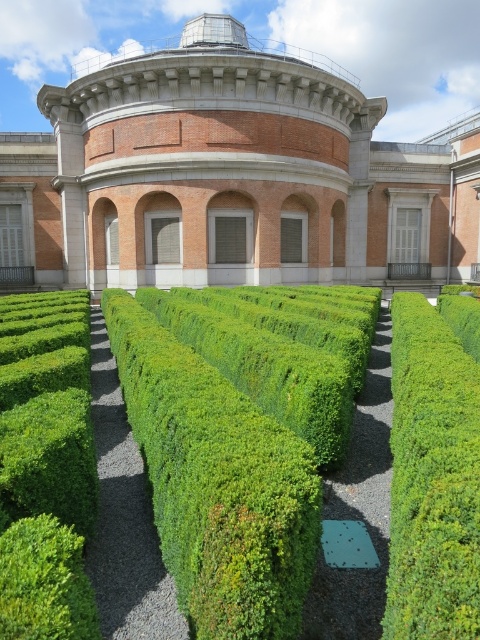
Question: Which point is closer to the camera?

Choices:
 (A) (374, 150)
 (B) (410, 308)
 (C) (33, 586)
 (D) (410, 536)

Answer: (C)

Question: Among these objects, which one is nearest to the camera?

Choices:
 (A) green leafy hedge at center
 (B) green leafy bush at lower left

Answer: (B)

Question: Is green leafy bush at left further to camera compared to green leafy bush at center?

Choices:
 (A) no
 (B) yes

Answer: (A)

Question: Which object appears farthest from the camera in this image?

Choices:
 (A) green leafy bush at center
 (B) green leafy hedge at center
 (C) green leafy bush at lower left
 (D) brick wall at center

Answer: (D)

Question: Can you confirm if green leafy bush at left is positioned above green leafy bush at lower left?

Choices:
 (A) yes
 (B) no

Answer: (A)

Question: In this image, where is brick wall at center located relative to green leafy hedge at center?

Choices:
 (A) left
 (B) right

Answer: (A)